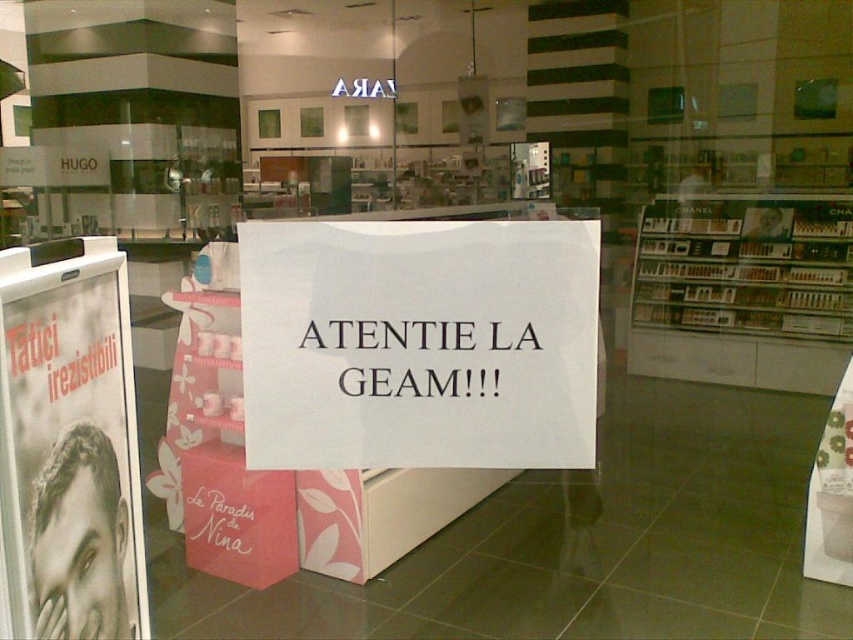
You are a customer in the store and want to compare the sizes of the white paper sign at center and the black glossy poster at left. Which one is bigger?

The white paper sign at center is larger in size than the black glossy poster at left.

You are a customer in a store and want to find the white paper sign at center. According to the store layout, where should you look to find it?

The white paper sign at center is located at point coordinates (x=419, y=342). So you should look towards the center of the store where the coordinates point to.

From the picture: You are a customer in the store and want to read both the white paper sign at center and the black glossy poster at left. Which one do you need to move closer to first?

The black glossy poster at left is behind the white paper sign at center, so you need to move closer to the white paper sign at center first to see the poster behind it.